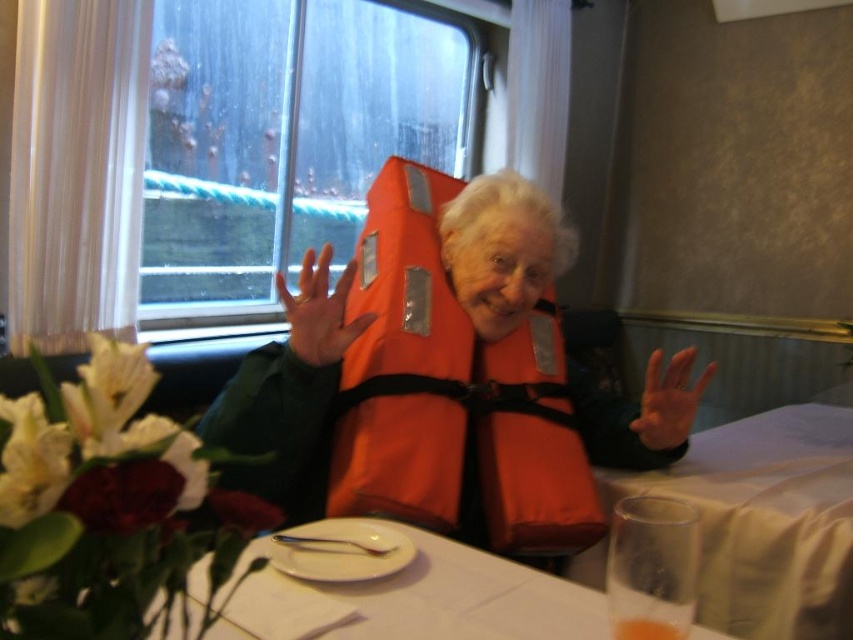
Question: Is transparent glass window at upper left smaller than orange matte life jacket at center?

Choices:
 (A) yes
 (B) no

Answer: (B)

Question: Estimate the real-world distances between objects in this image. Which object is closer to the white paper plate at center?

Choices:
 (A) orange life vest at center
 (B) orange matte life jacket at center
 (C) transparent glass at lower right
 (D) orange matte life vest at center

Answer: (B)

Question: Is transparent glass window at upper left bigger than orange matte life vest at center?

Choices:
 (A) yes
 (B) no

Answer: (A)

Question: Considering the real-world distances, which object is farthest from the orange matte life jacket at center?

Choices:
 (A) transparent glass window at upper left
 (B) orange matte life vest at center

Answer: (A)

Question: In this image, where is white paper plate at center located relative to orange life vest at center?

Choices:
 (A) below
 (B) above

Answer: (A)

Question: Among these points, which one is nearest to the camera?

Choices:
 (A) (721, 516)
 (B) (207, 52)

Answer: (A)